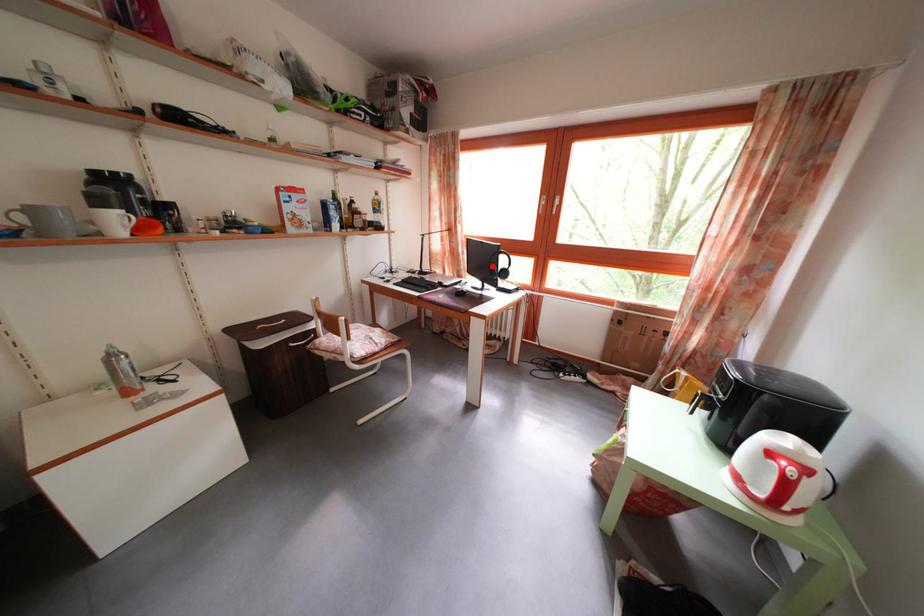
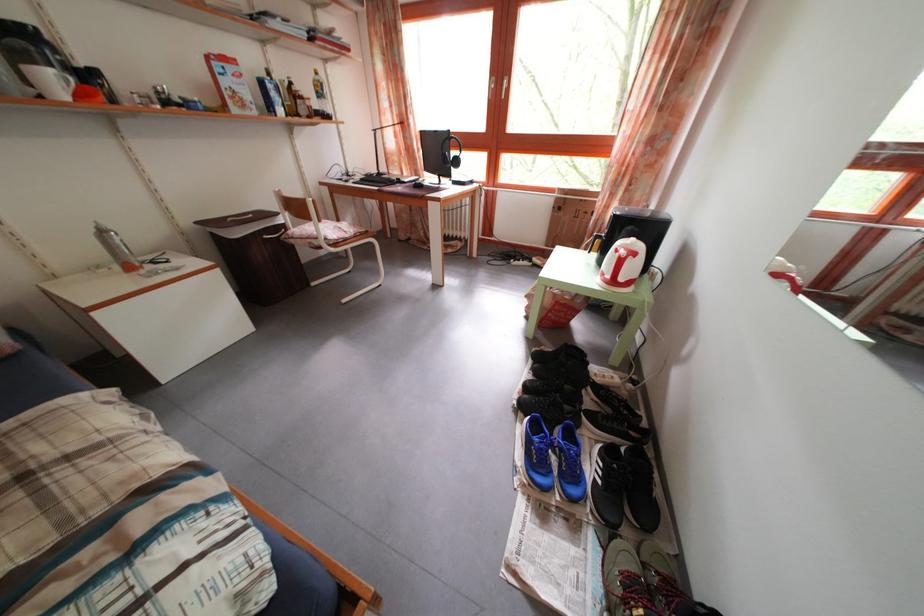
Where in the second image is the point corresponding to the highlighted location from the first image?

(446, 160)